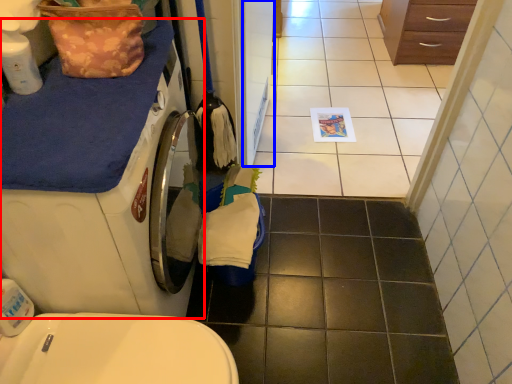
Question: Which point is closer to the camera, washing machine (highlighted by a red box) or screen door (highlighted by a blue box)?

Choices:
 (A) washing machine
 (B) screen door

Answer: (A)